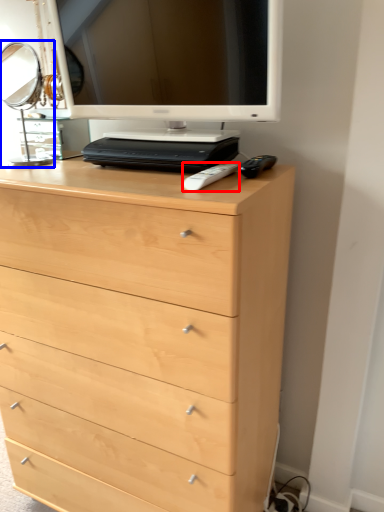
Question: Which object appears farthest to the camera in this image, remote (highlighted by a red box) or table lamp (highlighted by a blue box)?

Choices:
 (A) remote
 (B) table lamp

Answer: (B)